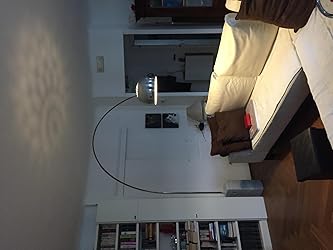
What are the coordinates of `footrest` in the screenshot? It's located at [305, 163].